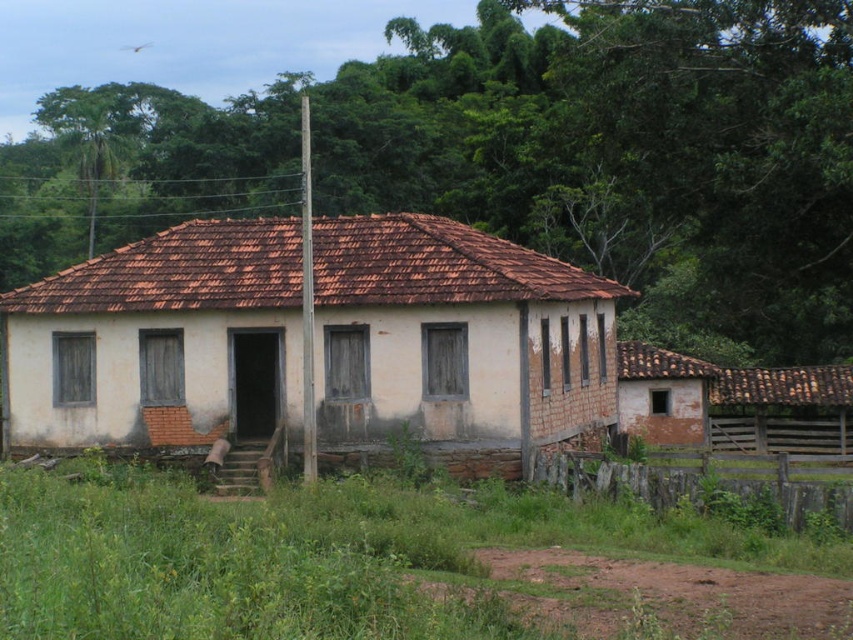
Which is more to the right, white plastered wall at center or brown wooden fence at lower right?

brown wooden fence at lower right is more to the right.

Does point (77, 337) lie in front of point (648, 481)?

No, it is not.

I want to click on white plastered wall at center, so click(456, 340).

Where is `white plastered wall at center`? This screenshot has height=640, width=853. white plastered wall at center is located at coordinates (456, 340).